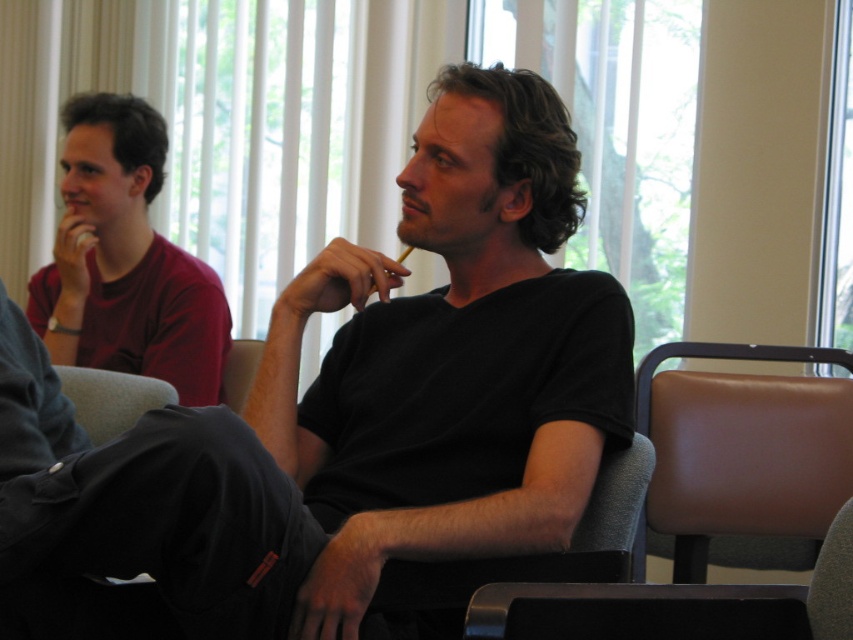
Can you confirm if matte red shirt at left is positioned to the right of gray fabric chair at lower right?

No, matte red shirt at left is not to the right of gray fabric chair at lower right.

Between matte red shirt at left and gray fabric chair at lower right, which one is positioned lower?

gray fabric chair at lower right

Find the location of a particular element. matte red shirt at left is located at coordinates (125, 260).

Find the location of a particular element. The height and width of the screenshot is (640, 853). matte red shirt at left is located at coordinates (125, 260).

The width and height of the screenshot is (853, 640). Describe the element at coordinates (125, 260) in the screenshot. I see `matte red shirt at left` at that location.

Between point (140, 177) and point (241, 381), which one is positioned behind?

Positioned behind is point (140, 177).

Between point (212, 317) and point (231, 353), which one is positioned in front?

Point (212, 317)

This screenshot has width=853, height=640. In order to click on matte red shirt at left in this screenshot , I will do `click(125, 260)`.

What do you see at coordinates (125, 260) in the screenshot? I see `matte red shirt at left` at bounding box center [125, 260].

Describe the element at coordinates (125, 260) in the screenshot. I see `matte red shirt at left` at that location.

In order to click on matte red shirt at left in this screenshot , I will do `click(125, 260)`.